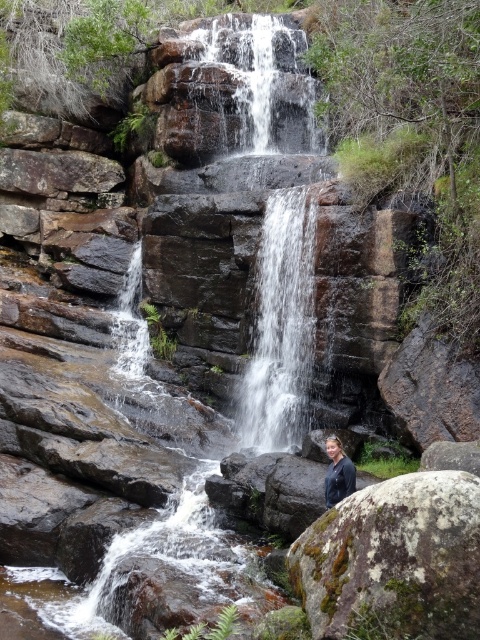
Does point (404, 604) come behind point (272, 208)?

No, (404, 604) is closer to viewer.

Is mossy rock at lower right positioned in front of clear water at center?

Yes.

Between point (397, 588) and point (312, 232), which one is positioned behind?

The point (312, 232) is behind.

The height and width of the screenshot is (640, 480). I want to click on mossy rock at lower right, so click(395, 557).

Looking at this image, who is higher up, clear water at center or dark blue jacket at center?

clear water at center is higher up.

Between clear water at center and dark blue jacket at center, which one appears on the right side from the viewer's perspective?

dark blue jacket at center is more to the right.

Identify the location of clear water at center. (280, 324).

Between point (437, 500) and point (355, 472), which one is positioned behind?

The point (355, 472) is more distant.

Is mossy rock at lower right taller than dark blue jacket at center?

Indeed, mossy rock at lower right has a greater height compared to dark blue jacket at center.

Is point (446, 618) positioned after point (324, 499)?

No, (446, 618) is closer to viewer.

You are a GUI agent. You are given a task and a screenshot of the screen. Output one action in this format:
    pyautogui.click(x=<x>, y=<y>)
    Task: Click on the mossy rock at lower right
    The image size is (480, 640).
    Given the screenshot: What is the action you would take?
    pyautogui.click(x=395, y=557)